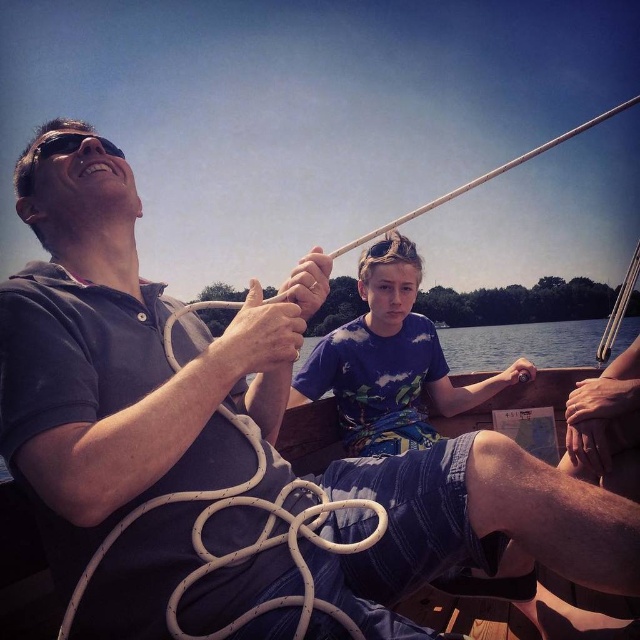
Is point (376, 282) positioned behind point (108, 148)?

Yes, point (376, 282) is behind point (108, 148).

Which is in front, point (368, 368) or point (108, 145)?

Point (108, 145) is in front.

Find the location of a particular element. This screenshot has width=640, height=640. blue printed shirt at center is located at coordinates (388, 362).

Is white matte rope at center bigger than black matte sunglasses at upper left?

No.

Between white matte rope at center and black matte sunglasses at upper left, which one is positioned lower?

white matte rope at center is lower down.

Find the location of a particular element. white matte rope at center is located at coordinates (246, 545).

Measure the distance between blue printed shirt at center and white matte rope at center.

The distance of blue printed shirt at center from white matte rope at center is 5.03 feet.

Where is `blue printed shirt at center`? blue printed shirt at center is located at coordinates (388, 362).

Where is `blue printed shirt at center`? The image size is (640, 640). blue printed shirt at center is located at coordinates (388, 362).